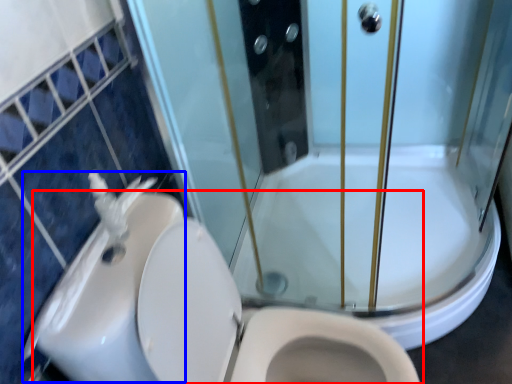
Question: Among these objects, which one is farthest to the camera, toilet (highlighted by a red box) or sink (highlighted by a blue box)?

Choices:
 (A) toilet
 (B) sink

Answer: (B)